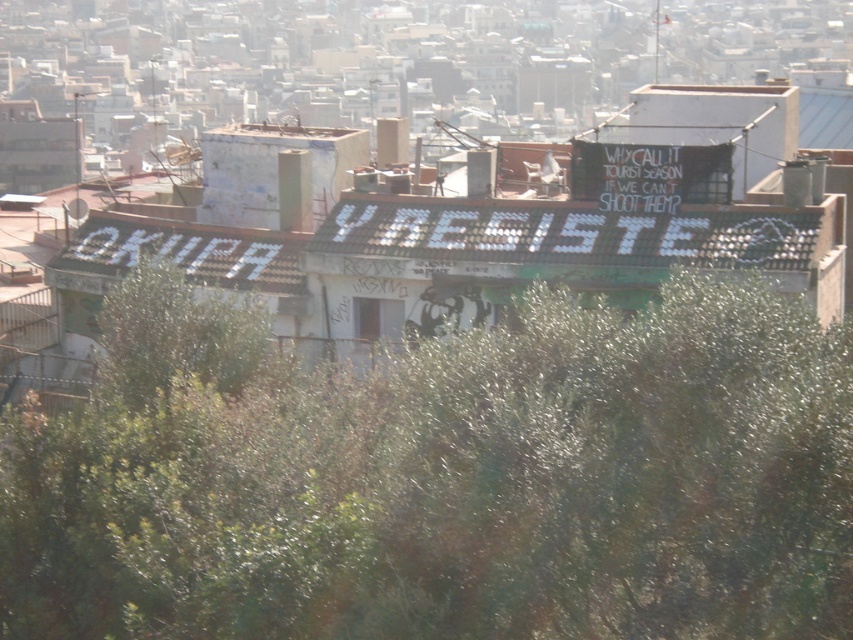
Question: Does white tile roof at center have a greater width compared to white corrugated metal roof at center?

Choices:
 (A) no
 (B) yes

Answer: (B)

Question: Can you confirm if green leafy tree at center is positioned to the left of white tile roof at center?

Choices:
 (A) no
 (B) yes

Answer: (B)

Question: Does white tile roof at center appear on the left side of white corrugated metal roof at center?

Choices:
 (A) no
 (B) yes

Answer: (A)

Question: Which point is closer to the camera?

Choices:
 (A) (158, 250)
 (B) (844, 508)
 (C) (392, 256)

Answer: (B)

Question: Which object is positioned farthest from the white tile roof at center?

Choices:
 (A) green leafy tree at center
 (B) white corrugated metal roof at center

Answer: (A)

Question: Which point is farther to the camera?

Choices:
 (A) white tile roof at center
 (B) green leafy tree at center

Answer: (A)